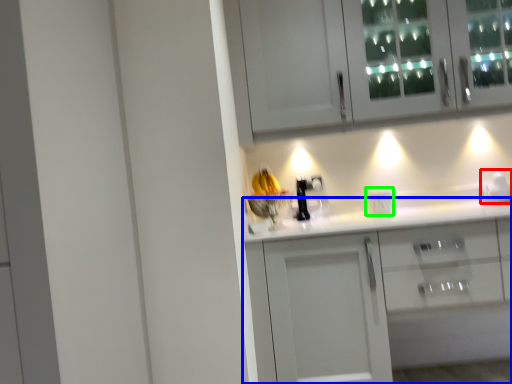
Question: Based on their relative distances, which object is farther from appliance (highlighted by a red box)? Choose from cabinetry (highlighted by a blue box) and electric outlet (highlighted by a green box).

Choices:
 (A) cabinetry
 (B) electric outlet

Answer: (A)